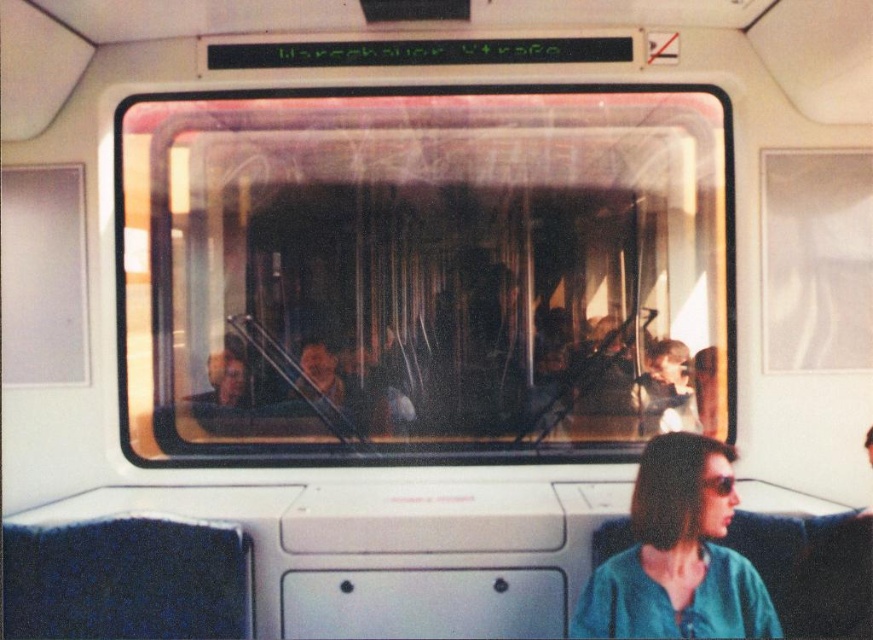
You are a passenger in the train car and want to see the scenery outside through the transparent glass train window at center. However, your view is partially blocked by the teal fabric shirt at lower right. Can you move your seat to the left or right to avoid the obstruction?

The transparent glass train window at center is positioned over the teal fabric shirt at lower right, meaning the shirt is below the window. Moving your seat to the left or right might not help since the obstruction is directly below the window. Consider standing up or moving forward to get a better view.

You are a passenger trying to see the scenery outside through the transparent glass train window at center while sitting next to the teal fabric shirt at lower right. Can you tell if the window is wider than your shirt?

The transparent glass train window at center is wider than the teal fabric shirt at lower right, so yes, the window is wider than the shirt.

You are a passenger on the train and want to see the scenery outside through the transparent glass train window at center. However, there is a teal fabric shirt at lower right in your view. Can you still see the scenery clearly through the window?

The teal fabric shirt at lower right is behind the transparent glass train window at center, so it does not block your view of the scenery outside. You can still see the scenery clearly through the transparent glass train window at center.